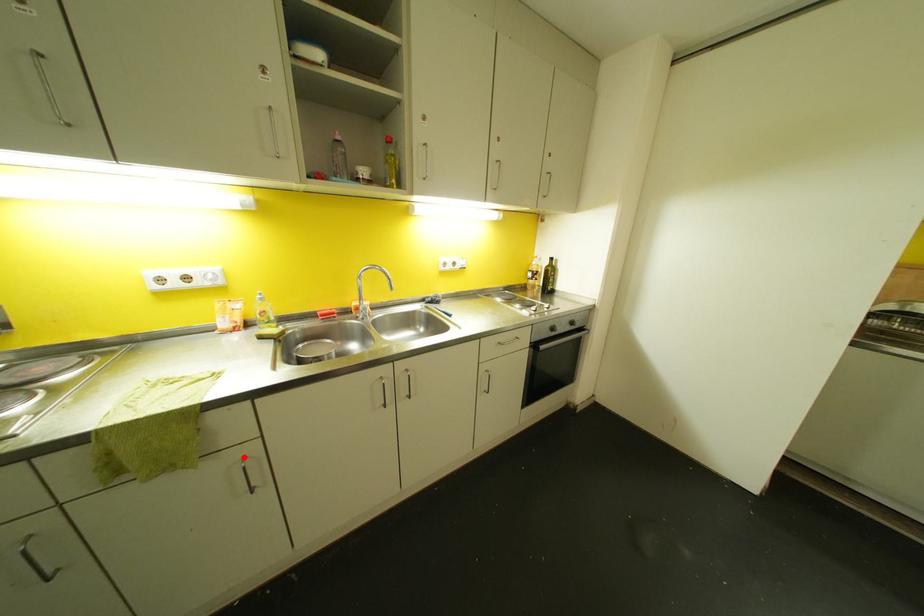
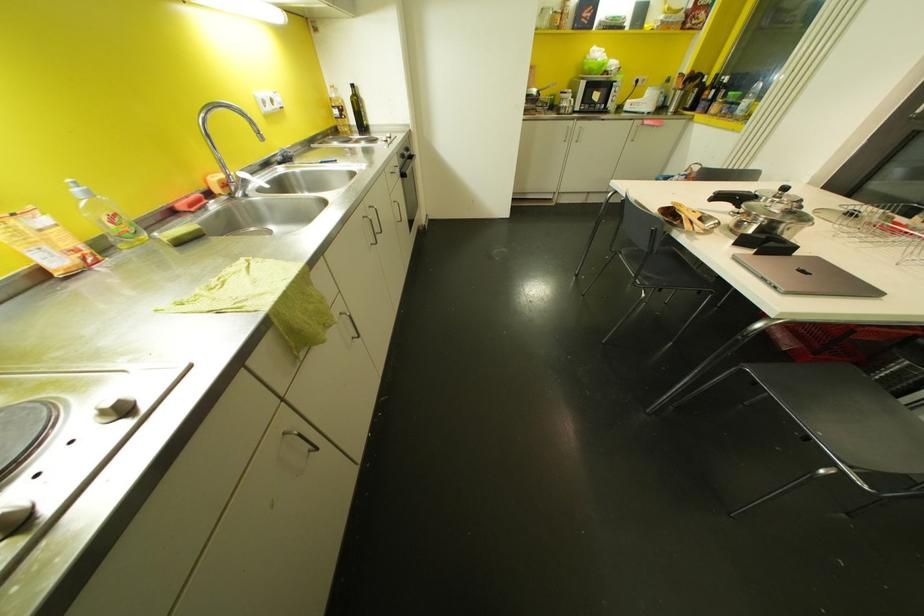
The point at the highlighted location is marked in the first image. Where is the corresponding point in the second image?

(339, 314)